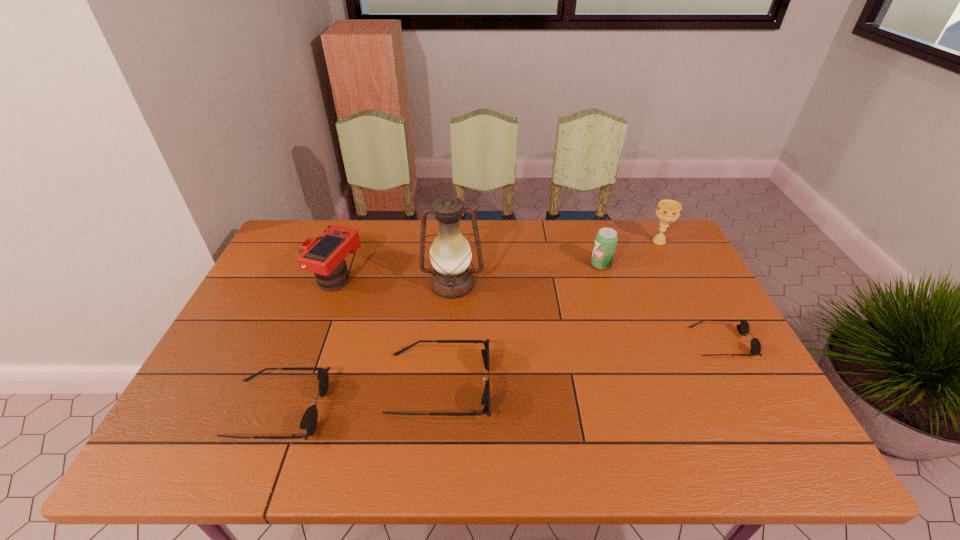
Where is `vacant space located on the front-facing side of the second sunglasses from right to left`? This screenshot has width=960, height=540. vacant space located on the front-facing side of the second sunglasses from right to left is located at coordinates (647, 385).

The width and height of the screenshot is (960, 540). Identify the location of vacant space located on the back of the camera. (347, 248).

I want to click on vacant space located 0.250m on the right of the oil lamp, so click(565, 285).

The image size is (960, 540). I want to click on vacant space located 0.240m on the left of the soda, so click(516, 265).

The height and width of the screenshot is (540, 960). Find the location of `free region located on the left of the farthest object`. free region located on the left of the farthest object is located at coordinates (615, 241).

The image size is (960, 540). What are the coordinates of `camera that is positioned at the far edge` in the screenshot? It's located at (324, 256).

The width and height of the screenshot is (960, 540). I want to click on soda positioned at the far edge, so click(606, 239).

You are a GUI agent. You are given a task and a screenshot of the screen. Output one action in this format:
    pyautogui.click(x=<x>, y=<y>)
    Task: Click on the chalice situated at the far edge
    This screenshot has height=540, width=960.
    Given the screenshot: What is the action you would take?
    pyautogui.click(x=668, y=211)

The image size is (960, 540). Identify the location of sunglasses located at the left edge. (309, 420).

Where is `camera that is positioned at the left edge`? camera that is positioned at the left edge is located at coordinates (324, 256).